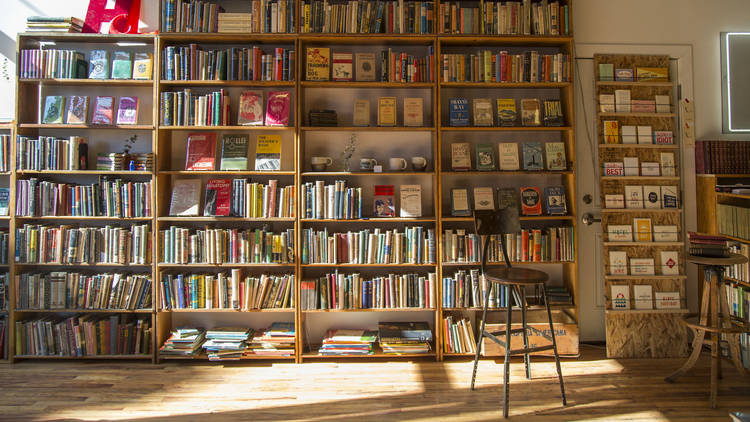
Where is `smaller thicker books`? smaller thicker books is located at coordinates (52, 68), (82, 103), (124, 67), (336, 71), (385, 112), (499, 105), (508, 144), (502, 195), (394, 200).